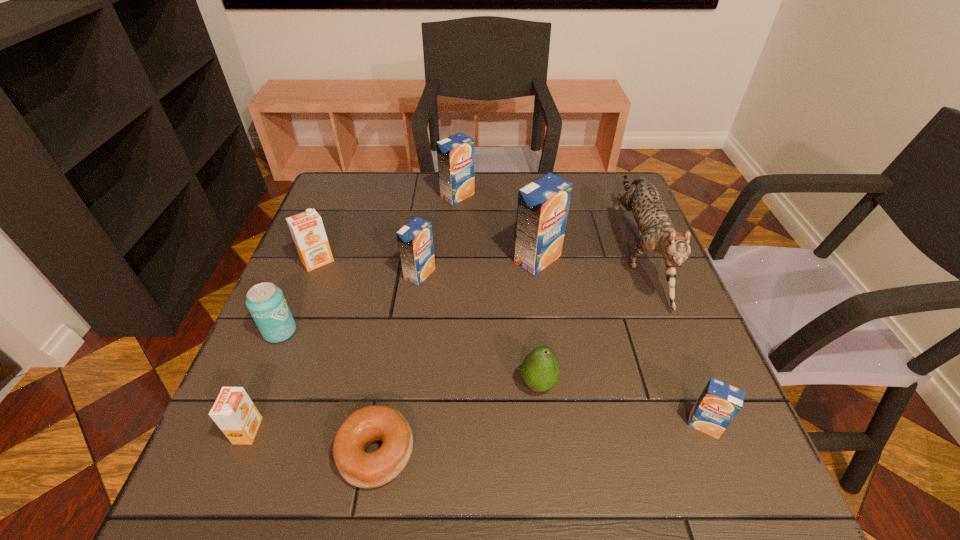
Identify which orange juice is the fifth nearest to the cat. Please provide its 2D coordinates. Your answer should be formatted as a tuple, i.e. [(x, y)], where the tuple contains the x and y coordinates of a point satisfying the conditions above.

[(307, 229)]

Locate which blue orange_juice is the fourth closest to the cat. Please provide its 2D coordinates. Your answer should be formatted as a tuple, i.e. [(x, y)], where the tuple contains the x and y coordinates of a point satisfying the conditions above.

[(415, 241)]

Find the location of `blue orange_juice that can be found as the third closest to the farthest blue orange_juice`. blue orange_juice that can be found as the third closest to the farthest blue orange_juice is located at coordinates (719, 403).

Identify the location of blank area in the image that satisfies the following two spatial constraints: 1. on the face of the cat; 2. on the left side of the nearest blue orange_juice. The height and width of the screenshot is (540, 960). click(x=705, y=424).

Locate an element on the screen. free space that satisfies the following two spatial constraints: 1. on the front side of the bagel; 2. on the right side of the farther orange orange juice is located at coordinates (243, 453).

Image resolution: width=960 pixels, height=540 pixels. Find the location of `vacant space that satisfies the following two spatial constraints: 1. on the back side of the biggest blue orange_juice; 2. on the left side of the third biggest blue orange_juice`. vacant space that satisfies the following two spatial constraints: 1. on the back side of the biggest blue orange_juice; 2. on the left side of the third biggest blue orange_juice is located at coordinates pos(421,259).

The width and height of the screenshot is (960, 540). What are the coordinates of `vacant region that satisfies the following two spatial constraints: 1. on the front side of the farther orange orange juice; 2. on the right side of the second smallest blue orange_juice` in the screenshot? It's located at (313, 274).